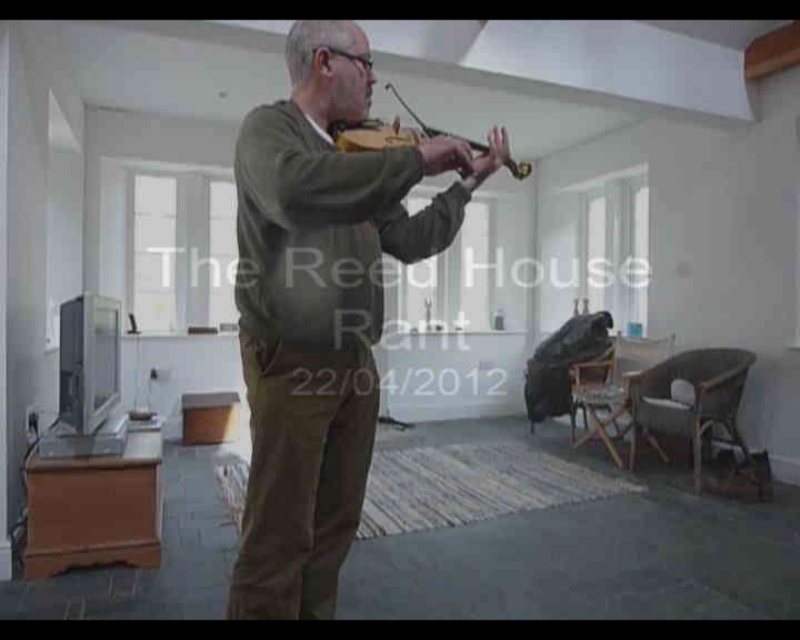
Question: Which point is farther to the camera?

Choices:
 (A) matte green sweater at center
 (B) wooden violin at center

Answer: (B)

Question: Which object appears farthest from the camera in this image?

Choices:
 (A) wooden violin at center
 (B) matte green sweater at center

Answer: (A)

Question: Observing the image, what is the correct spatial positioning of matte green sweater at center in reference to wooden violin at center?

Choices:
 (A) left
 (B) right

Answer: (A)

Question: Does matte green sweater at center have a greater width compared to wooden violin at center?

Choices:
 (A) yes
 (B) no

Answer: (A)

Question: Among these points, which one is nearest to the camera?

Choices:
 (A) (306, 220)
 (B) (368, 148)

Answer: (A)

Question: In this image, where is matte green sweater at center located relative to wooden violin at center?

Choices:
 (A) right
 (B) left

Answer: (B)